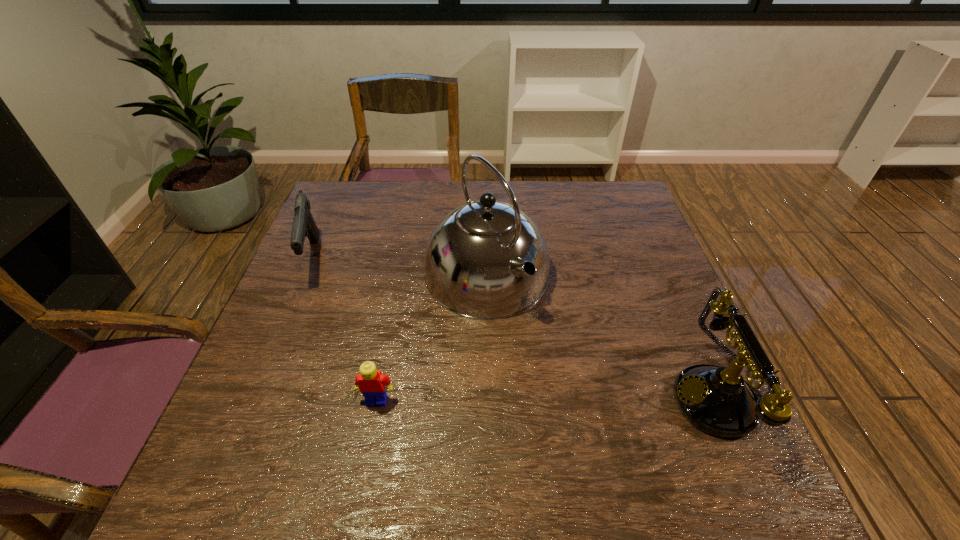
Locate an element on the screen. vacant area between the rightmost object and the Lego is located at coordinates (550, 399).

Locate an element on the screen. The height and width of the screenshot is (540, 960). unoccupied position between the second object from right to left and the third object from right to left is located at coordinates (432, 338).

At what (x,y) coordinates should I click in order to perform the action: click on vacant point located between the shortest object and the kettle. Please return your answer as a coordinate pair (x, y). The width and height of the screenshot is (960, 540). Looking at the image, I should click on (432, 338).

What are the coordinates of `vacant region between the third object from right to left and the gun` in the screenshot? It's located at (346, 329).

Find the location of `unoccupied position between the leftmost object and the tallest object`. unoccupied position between the leftmost object and the tallest object is located at coordinates (400, 266).

The width and height of the screenshot is (960, 540). I want to click on blank region between the kettle and the rightmost object, so click(605, 336).

At what (x,y) coordinates should I click in order to perform the action: click on empty space that is in between the kettle and the Lego. Please return your answer as a coordinate pair (x, y). The height and width of the screenshot is (540, 960). Looking at the image, I should click on (432, 338).

The height and width of the screenshot is (540, 960). What are the coordinates of `vacant region between the shortest object and the second object from right to left` in the screenshot? It's located at (432, 338).

Locate an element on the screen. Image resolution: width=960 pixels, height=540 pixels. vacant area that lies between the gun and the tallest object is located at coordinates 400,266.

The width and height of the screenshot is (960, 540). Find the location of `vacant area that lies between the second shortest object and the kettle`. vacant area that lies between the second shortest object and the kettle is located at coordinates (400, 266).